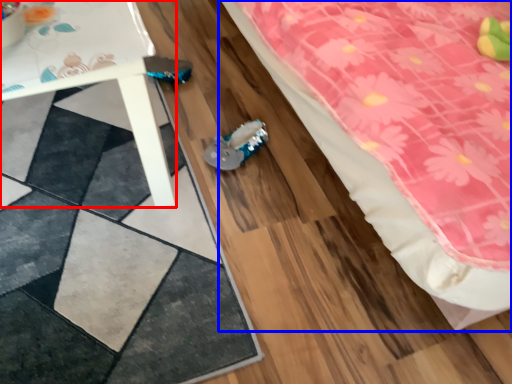
Question: Which of the following is the farthest to the observer, table (highlighted by a red box) or bed (highlighted by a blue box)?

Choices:
 (A) table
 (B) bed

Answer: (A)